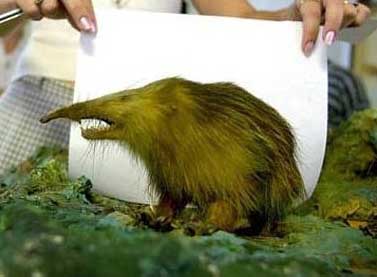
Find the location of a particular element. room background is located at coordinates (368, 85).